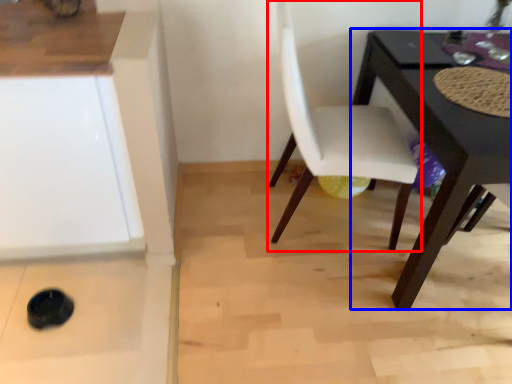
Question: Which of the following is the farthest to the observer, chair (highlighted by a red box) or table (highlighted by a blue box)?

Choices:
 (A) chair
 (B) table

Answer: (A)